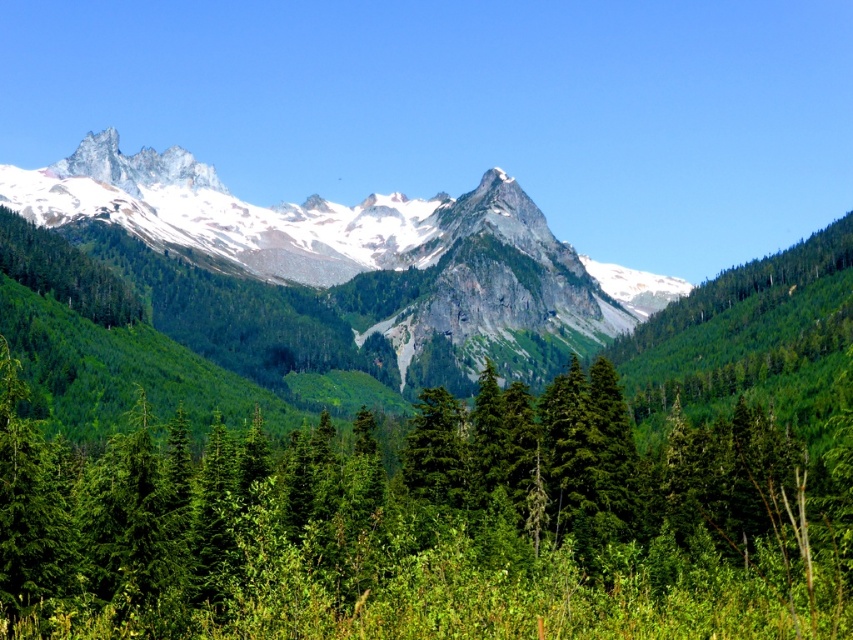
Identify the location of green matte tree at center. (427, 525).

Which is in front, point (80, 604) or point (155, 152)?

Point (80, 604) is in front.

Find the location of `green matte tree at center`. green matte tree at center is located at coordinates (427, 525).